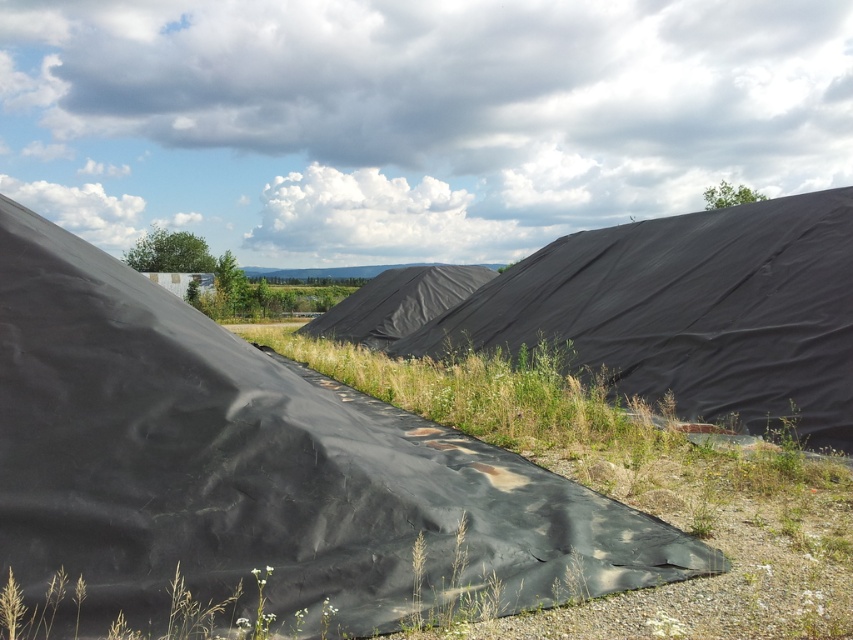
The width and height of the screenshot is (853, 640). Find the location of `black tarp at center`. black tarp at center is located at coordinates (692, 308).

Does black tarp at center have a larger size compared to black matte tent at center?

Actually, black tarp at center might be smaller than black matte tent at center.

This screenshot has height=640, width=853. I want to click on black tarp at center, so click(x=692, y=308).

This screenshot has height=640, width=853. What are the coordinates of `black tarp at center` in the screenshot? It's located at (692, 308).

Who is positioned more to the right, green matte grass at center or black tarp at center?

black tarp at center

Is point (846, 496) positioned before point (724, 374)?

That is True.

This screenshot has width=853, height=640. Find the location of `green matte grass at center`. green matte grass at center is located at coordinates (637, 492).

This screenshot has height=640, width=853. Identify the location of black matte tarp at center. (260, 474).

Between black matte tarp at center and black matte tent at center, which one has less height?

black matte tarp at center is shorter.

Locate an element on the screen. This screenshot has width=853, height=640. black matte tarp at center is located at coordinates (260, 474).

This screenshot has width=853, height=640. What are the coordinates of `black matte tarp at center` in the screenshot? It's located at (260, 474).